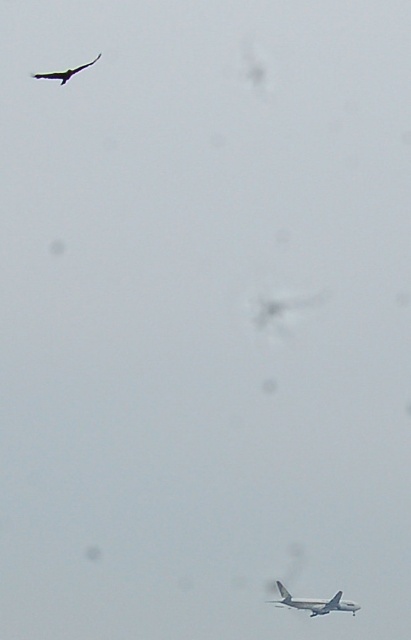
Which is more to the right, silver metallic airplane at lower center or dark gray feathers at upper left?

Positioned to the right is silver metallic airplane at lower center.

Who is higher up, silver metallic airplane at lower center or dark gray feathers at upper left?

Positioned higher is dark gray feathers at upper left.

Find the location of a particular element. The image size is (411, 640). silver metallic airplane at lower center is located at coordinates (314, 602).